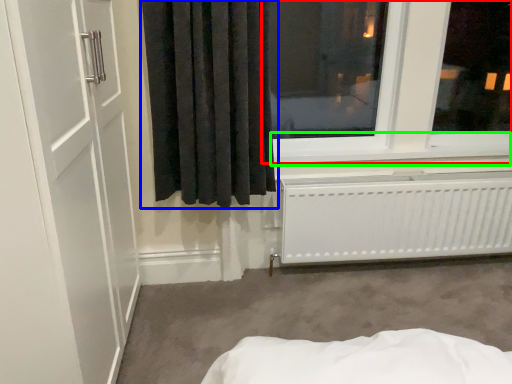
Question: Estimate the real-world distances between objects in this image. Which object is closer to window (highlighted by a red box), curtain (highlighted by a blue box) or window sill (highlighted by a green box)?

Choices:
 (A) curtain
 (B) window sill

Answer: (B)